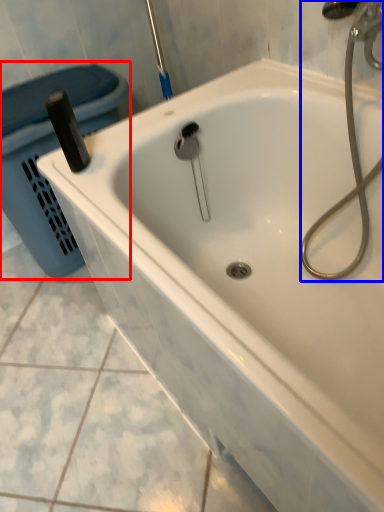
Question: Which of the following is the closest to the observer, laundry basket (highlighted by a red box) or plumbing fixture (highlighted by a blue box)?

Choices:
 (A) laundry basket
 (B) plumbing fixture

Answer: (B)